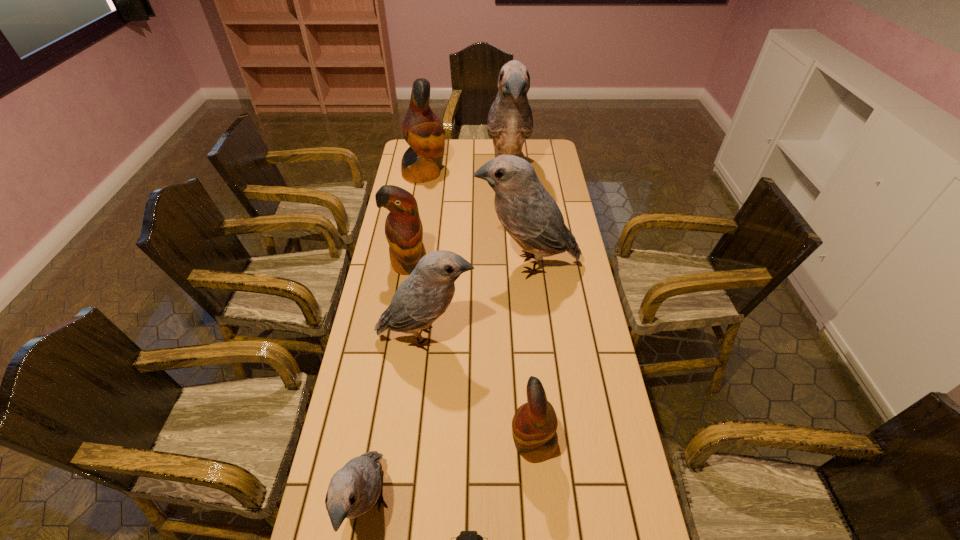
Identify which parrot is the fourth closest to the headset. Please provide its 2D coordinates. Your answer should be formatted as a tuple, i.e. [(x, y)], where the tuple contains the x and y coordinates of a point satisfying the conditions above.

[(530, 215)]

This screenshot has width=960, height=540. Find the location of `the second closest gray parrot relative to the tallest object`. the second closest gray parrot relative to the tallest object is located at coordinates [x=424, y=296].

Identify the location of gray parrot that is the fourth closest to the second nearest red parrot. (355, 489).

Identify the location of red parrot identified as the closest to the third smallest gray parrot. click(403, 228).

Select which red parrot appears as the second closest to the smallest gray parrot. Please provide its 2D coordinates. Your answer should be formatted as a tuple, i.e. [(x, y)], where the tuple contains the x and y coordinates of a point satisfying the conditions above.

[(403, 228)]

I want to click on free location that satisfies the following two spatial constraints: 1. on the front-facing side of the second farthest gray parrot; 2. on the face of the second biggest red parrot, so click(526, 265).

Where is `vacant region that satisfies the following two spatial constraints: 1. on the face of the biggest red parrot; 2. on the face of the second farthest red parrot`? This screenshot has height=540, width=960. vacant region that satisfies the following two spatial constraints: 1. on the face of the biggest red parrot; 2. on the face of the second farthest red parrot is located at coordinates (410, 265).